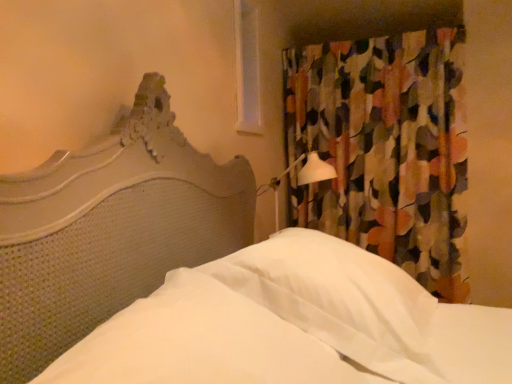
The height and width of the screenshot is (384, 512). I want to click on multicolored fabric curtain at upper right, so click(x=383, y=148).

What do you see at coordinates (198, 342) in the screenshot? I see `white fabric sheet at center` at bounding box center [198, 342].

The width and height of the screenshot is (512, 384). What are the coordinates of `multicolored fabric curtain at upper right` in the screenshot? It's located at (383, 148).

From the image's perspective, is white soft pillow at center under white plastic window at upper center?

Yes, from the image's perspective, white soft pillow at center is beneath white plastic window at upper center.

How different are the orientations of white soft pillow at center and white plastic window at upper center in degrees?

The facing directions of white soft pillow at center and white plastic window at upper center are 0.775 degrees apart.

In terms of size, does white soft pillow at center appear bigger or smaller than white plastic window at upper center?

Considering their sizes, white soft pillow at center takes up more space than white plastic window at upper center.

Are white soft pillow at center and white plastic window at upper center far apart?

Yes.

Can you see white plastic window at upper center touching white soft pillow at center?

No, white plastic window at upper center is not in contact with white soft pillow at center.

From a real-world perspective, relative to white soft pillow at center, is white plastic window at upper center vertically above or below?

white plastic window at upper center is above white soft pillow at center.

Is point (252, 48) positioned behind point (238, 256)?

That is True.

How different are the orientations of white fabric sheet at center and white plastic window at upper center in degrees?

white fabric sheet at center and white plastic window at upper center are facing 0.775 degrees away from each other.

Is white plastic window at upper center completely or partially inside white fabric sheet at center?

Actually, white plastic window at upper center is outside white fabric sheet at center.

Does white fabric sheet at center have a lesser height compared to white plastic window at upper center?

Yes, white fabric sheet at center is shorter than white plastic window at upper center.

Between white fabric sheet at center and white plastic window at upper center, which one appears on the right side from the viewer's perspective?

white fabric sheet at center.

Are white soft pillow at center and white fabric sheet at center far apart?

No, there isn't a large distance between white soft pillow at center and white fabric sheet at center.

From the image's perspective, is white soft pillow at center positioned above or below white fabric sheet at center?

white soft pillow at center is situated higher than white fabric sheet at center in the image.

What's the angular difference between white soft pillow at center and white fabric sheet at center's facing directions?

0.000588 degrees.

Could you tell me if white soft pillow at center is facing white fabric sheet at center?

No, white soft pillow at center is not turned towards white fabric sheet at center.

From the image's perspective, is multicolored fabric curtain at upper right located above white fabric sheet at center?

Yes.

Does multicolored fabric curtain at upper right have a lesser height compared to white fabric sheet at center?

In fact, multicolored fabric curtain at upper right may be taller than white fabric sheet at center.

From a real-world perspective, does multicolored fabric curtain at upper right sit lower than white fabric sheet at center?

Incorrect, from a real-world perspective, multicolored fabric curtain at upper right is higher than white fabric sheet at center.

Consider the image. Is white plastic window at upper center oriented towards white fabric sheet at center?

No.

The image size is (512, 384). What are the coordinates of `sheet below the white plastic window at upper center (from the image's perspective)` in the screenshot? It's located at (198, 342).

From a real-world perspective, relative to white fabric sheet at center, is white plastic window at upper center vertically above or below?

Clearly, from a real-world perspective, white plastic window at upper center is above white fabric sheet at center.

Is white plastic window at upper center shorter than white fabric sheet at center?

No.

Between multicolored fabric curtain at upper right and white plastic window at upper center, which one has larger width?

With larger width is multicolored fabric curtain at upper right.

How much distance is there between multicolored fabric curtain at upper right and white plastic window at upper center?

They are 32.11 inches apart.

Does multicolored fabric curtain at upper right have a larger size compared to white plastic window at upper center?

Indeed, multicolored fabric curtain at upper right has a larger size compared to white plastic window at upper center.

Can you confirm if multicolored fabric curtain at upper right is positioned to the left of white plastic window at upper center?

No.

At what (x,y) coordinates should I click in order to perform the action: click on pillow beneath the white plastic window at upper center (from a real-world perspective). Please return your answer as a coordinate pair (x, y). Looking at the image, I should click on 339,299.

There is a white soft pillow at center. What are the coordinates of `window above it (from a real-world perspective)` in the screenshot? It's located at (248, 68).

Which object lies further to the anchor point white fabric sheet at center, multicolored fabric curtain at upper right or white plastic window at upper center?

multicolored fabric curtain at upper right.

Estimate the real-world distances between objects in this image. Which object is further from white plastic window at upper center, multicolored fabric curtain at upper right or white fabric sheet at center?

white fabric sheet at center lies further to white plastic window at upper center than the other object.

Estimate the real-world distances between objects in this image. Which object is further from white fabric sheet at center, white plastic window at upper center or multicolored fabric curtain at upper right?

multicolored fabric curtain at upper right is further to white fabric sheet at center.

Considering their positions, is multicolored fabric curtain at upper right positioned further to white soft pillow at center than white plastic window at upper center?

multicolored fabric curtain at upper right is further to white soft pillow at center.

Considering their positions, is white soft pillow at center positioned further to white plastic window at upper center than white fabric sheet at center?

The object further to white plastic window at upper center is white fabric sheet at center.

Considering their positions, is white plastic window at upper center positioned further to multicolored fabric curtain at upper right than white soft pillow at center?

white soft pillow at center lies further to multicolored fabric curtain at upper right than the other object.

From the image, which object appears to be nearer to white plastic window at upper center, white soft pillow at center or multicolored fabric curtain at upper right?

multicolored fabric curtain at upper right lies closer to white plastic window at upper center than the other object.

Looking at the image, which one is located closer to white soft pillow at center, white plastic window at upper center or white fabric sheet at center?

white fabric sheet at center lies closer to white soft pillow at center than the other object.

The width and height of the screenshot is (512, 384). Find the location of `pillow between white fabric sheet at center and multicolored fabric curtain at upper right from front to back`. pillow between white fabric sheet at center and multicolored fabric curtain at upper right from front to back is located at coordinates (339, 299).

Locate an element on the screen. The width and height of the screenshot is (512, 384). window between white fabric sheet at center and multicolored fabric curtain at upper right in the front-back direction is located at coordinates (248, 68).

Image resolution: width=512 pixels, height=384 pixels. Identify the location of pillow between white fabric sheet at center and white plastic window at upper center from front to back. (339, 299).

Locate an element on the screen. This screenshot has width=512, height=384. window between white soft pillow at center and multicolored fabric curtain at upper right from front to back is located at coordinates (248, 68).